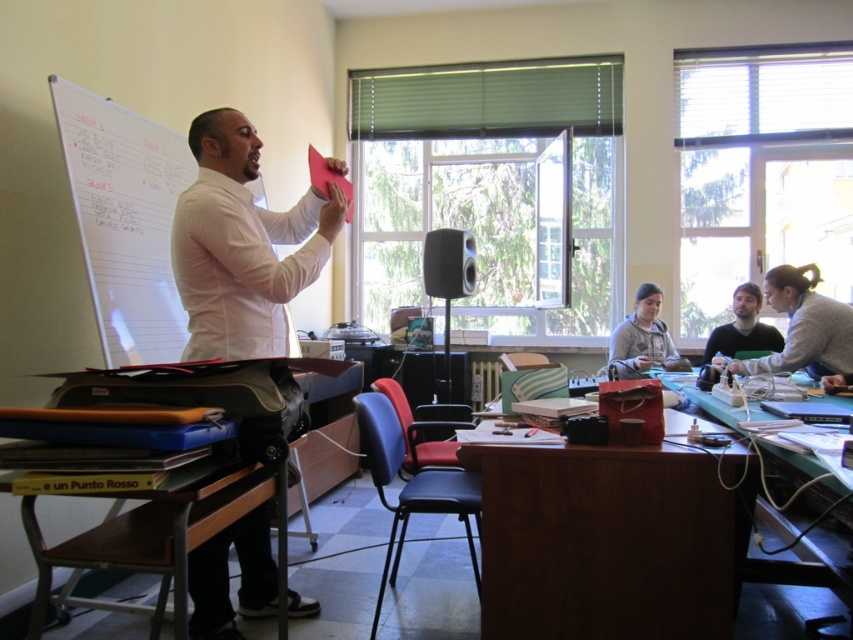
You are a student sitting at the desk in the classroom. You notice two people in the scene wearing the white matte shirt at center and the dark gray sweater at lower right. Which person is closer to you?

The white matte shirt at center is larger in size than the dark gray sweater at lower right, so the person wearing the white matte shirt at center is closer to you.

You are a student sitting at the desk and want to hand in your homework. You need to place your homework between the gray sweater at lower right and the gray fleece sweater at lower center. Which direction should you move to place it between them?

The gray sweater at lower right is positioned on the right side of gray fleece sweater at lower center. To place your homework between them, move it to the left side of the gray sweater at lower right or the right side of the gray fleece sweater at lower center.

You are a student carrying a 1.2 meter long poster and need to move from the wooden desk at center to the gray sweater at lower right. Is there enough space to walk while holding the poster horizontally between these two points?

The distance between the wooden desk at center and the gray sweater at lower right is 1.45 meters. Since the poster is 1.2 meters long, it will fit within the available space, so you can walk horizontally between them without issues.